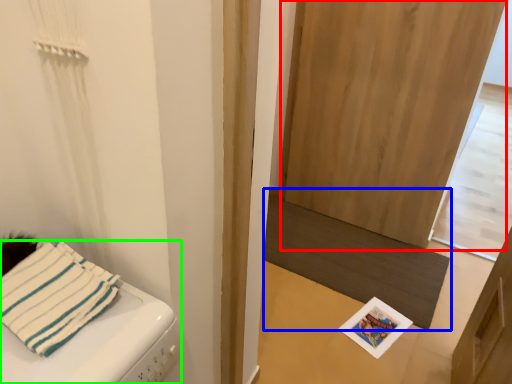
Question: Which object is the closest to the screen door (highlighted by a red box)? Choose among these: mat (highlighted by a blue box) or furniture (highlighted by a green box).

Choices:
 (A) mat
 (B) furniture

Answer: (A)